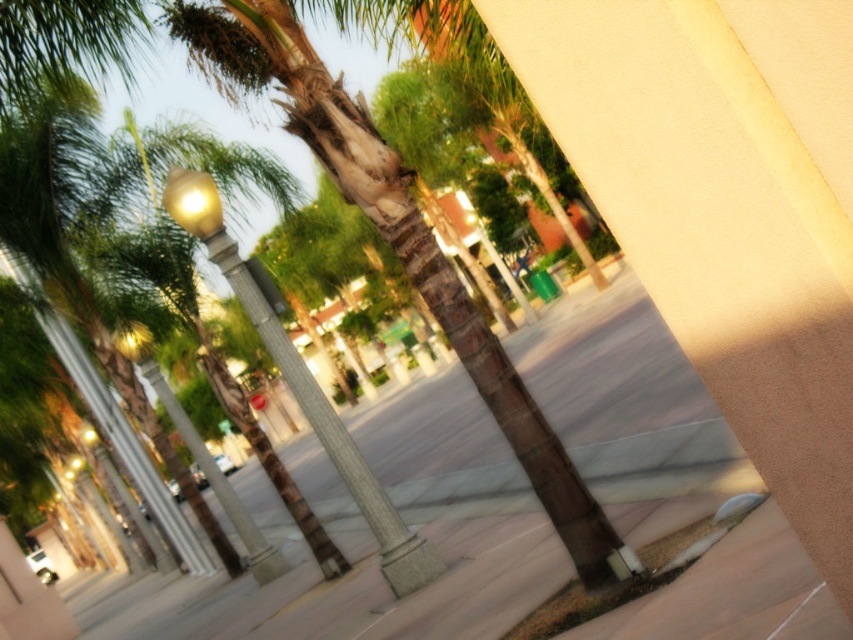
You are a delivery robot with a 3.5 feet wide package. You need to move from the smooth concrete pavement at center to the green textured palm tree at center. Can you fit through the space between them?

The smooth concrete pavement at center is 43.59 feet from the green textured palm tree at center, so yes, the robot can fit through the space between them since the distance is much larger than the robot and package width.

You are a delivery drone that needs to land on the smooth concrete pavement at center. However, you must avoid hitting the green textured palm tree at center. Based on the scene, can you safely land there without colliding with the tree?

The smooth concrete pavement at center has a greater height compared to green textured palm tree at center, so the drone can safely land there as the pavement is higher than the tree.

You are a city planner assessing the space between the smooth concrete pavement at center and the matte gold lamp post at left. Which object takes up more visual space in the image?

The smooth concrete pavement at center takes up more visual space than the matte gold lamp post at left because it is larger in size according to the description.